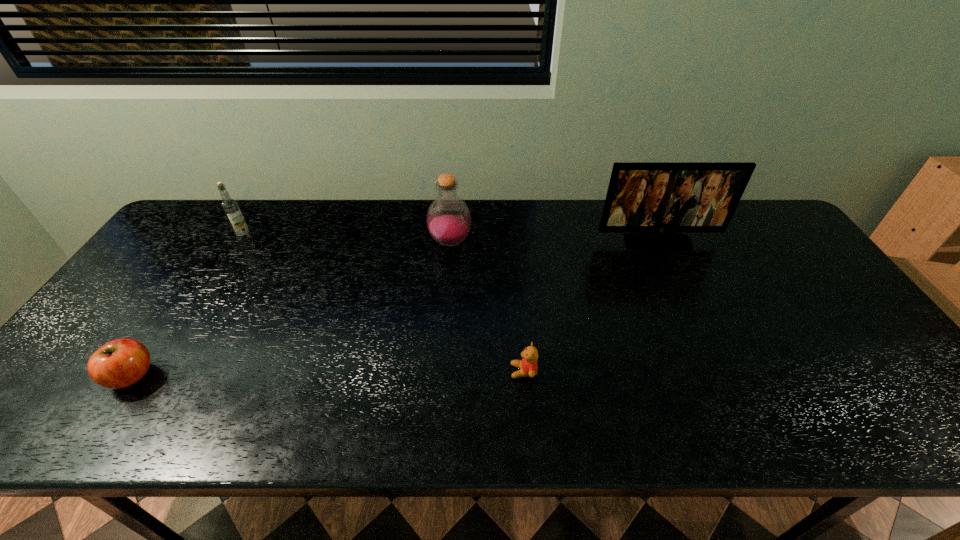
Identify the location of vacant space at the left edge of the desktop. (65, 383).

Image resolution: width=960 pixels, height=540 pixels. Identify the location of free space at the right edge of the desktop. (800, 265).

The width and height of the screenshot is (960, 540). In the image, there is a desktop. Find the location of `vacant space at the far left corner`. vacant space at the far left corner is located at coordinates (186, 227).

The height and width of the screenshot is (540, 960). In order to click on vacant area at the near right corner of the desktop in this screenshot , I will do `click(930, 416)`.

Image resolution: width=960 pixels, height=540 pixels. I want to click on free space between the apple and the third object from left to right, so click(x=291, y=309).

I want to click on free space between the apple and the third object from right to left, so click(291, 309).

Identify the location of free space between the vodka and the bottle. (348, 240).

Find the location of a particular element. free space between the fourth object from left to right and the monitor is located at coordinates point(590,307).

Locate an element on the screen. Image resolution: width=960 pixels, height=540 pixels. free point between the teddy bear and the tallest object is located at coordinates (590, 307).

This screenshot has width=960, height=540. Find the location of `free area in between the apple and the vodka`. free area in between the apple and the vodka is located at coordinates point(188,307).